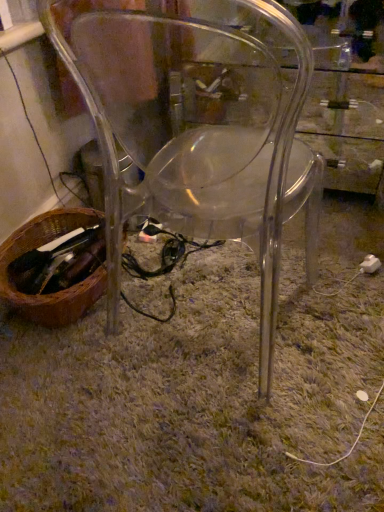
Locate an element on the screen. The height and width of the screenshot is (512, 384). free spot in front of white plastic plug at lower right is located at coordinates (361, 305).